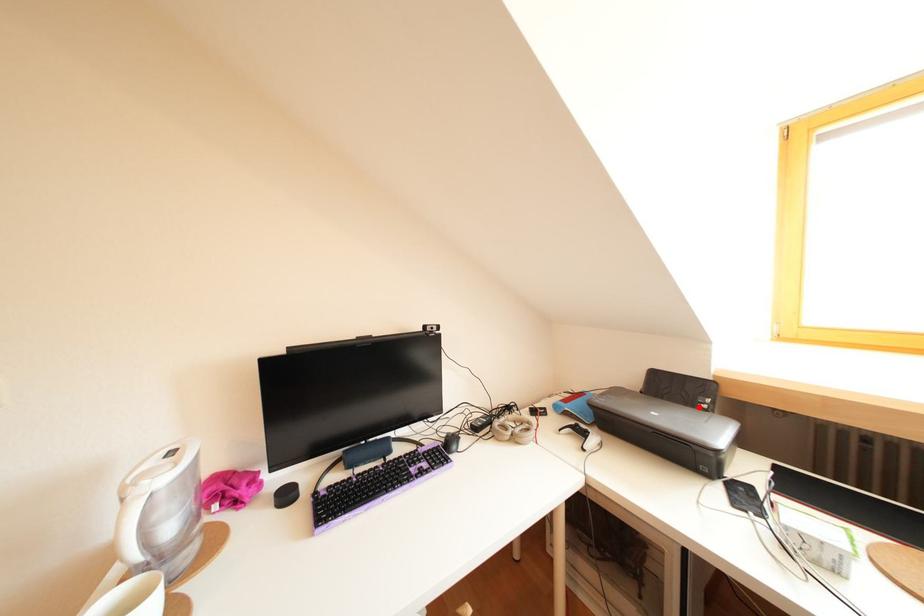
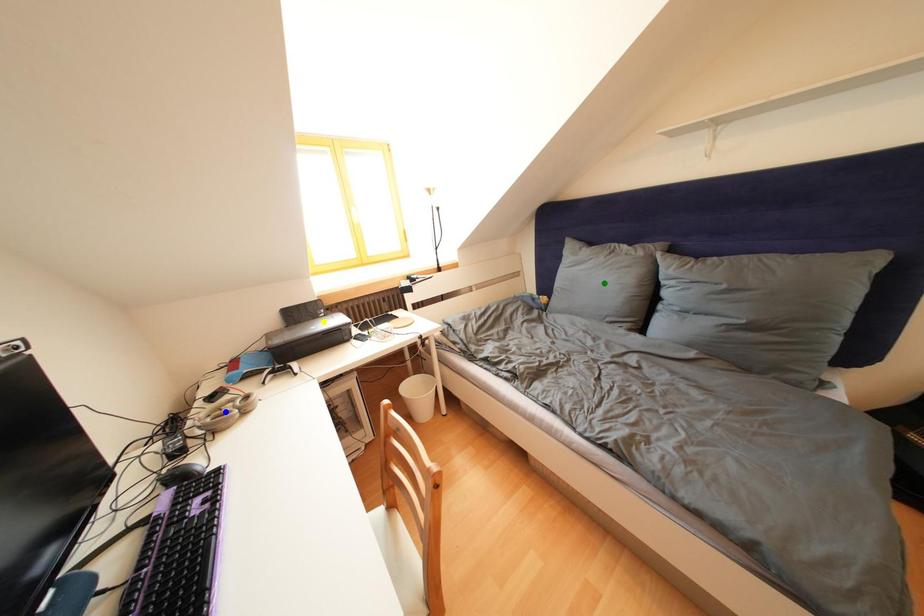
Question: I am providing you with two images of the same scene from different viewpoints. A red point is marked on the first image. You are given multiple points on the second image. Can you choose the point in image 2 that corresponds to the point in image 1?

Choices:
 (A) green point
 (B) blue point
 (C) yellow point

Answer: (C)